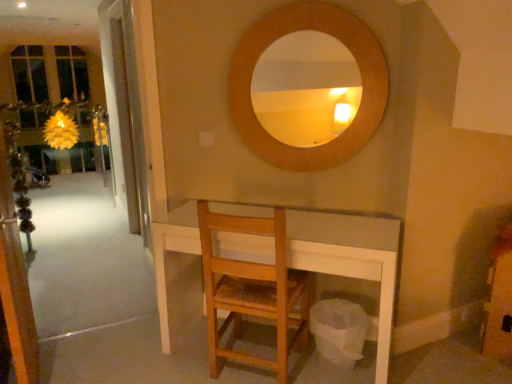
You are a GUI agent. You are given a task and a screenshot of the screen. Output one action in this format:
    pyautogui.click(x=<x>, y=<y>)
    Task: Click on the free space to the left of clear glass door at left, the first screen door in the back-to-front sequence
    The width and height of the screenshot is (512, 384).
    Given the screenshot: What is the action you would take?
    pyautogui.click(x=89, y=249)